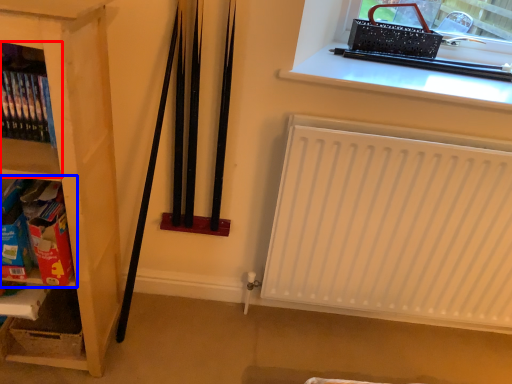
Question: Which object appears closest to the camera in this image, shelf (highlighted by a red box) or shelf (highlighted by a blue box)?

Choices:
 (A) shelf
 (B) shelf

Answer: (A)